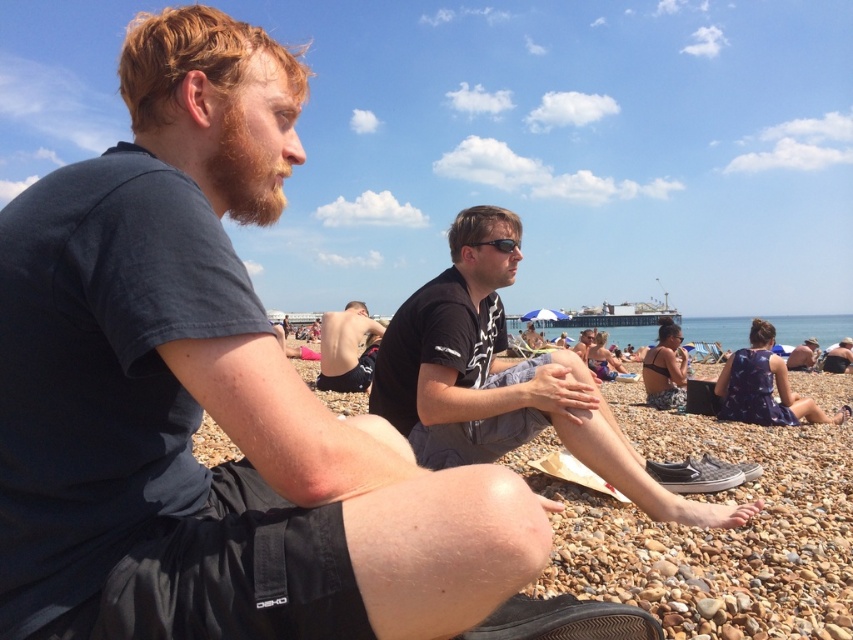
Question: Among these points, which one is farthest from the camera?

Choices:
 (A) (125, 420)
 (B) (824, 355)
 (C) (364, 376)
 (D) (815, 342)

Answer: (D)

Question: Estimate the real-world distances between objects in this image. Which object is closer to the reddish-brown stubble at left?

Choices:
 (A) black plastic sunglasses at center
 (B) dark blue t-shirt at center

Answer: (A)

Question: Is dark blue t-shirt at left to the right of reddish-brown stubble at left from the viewer's perspective?

Choices:
 (A) no
 (B) yes

Answer: (A)

Question: Which point is closer to the camera?

Choices:
 (A) dark blue fabric shirt at lower right
 (B) black matte shirt at center

Answer: (B)

Question: Does dark blue fabric shirt at lower right come in front of dark blue t-shirt at center?

Choices:
 (A) yes
 (B) no

Answer: (B)

Question: Observing the image, what is the correct spatial positioning of black matte shirt at center in reference to black plastic sunglasses at center?

Choices:
 (A) below
 (B) above

Answer: (A)